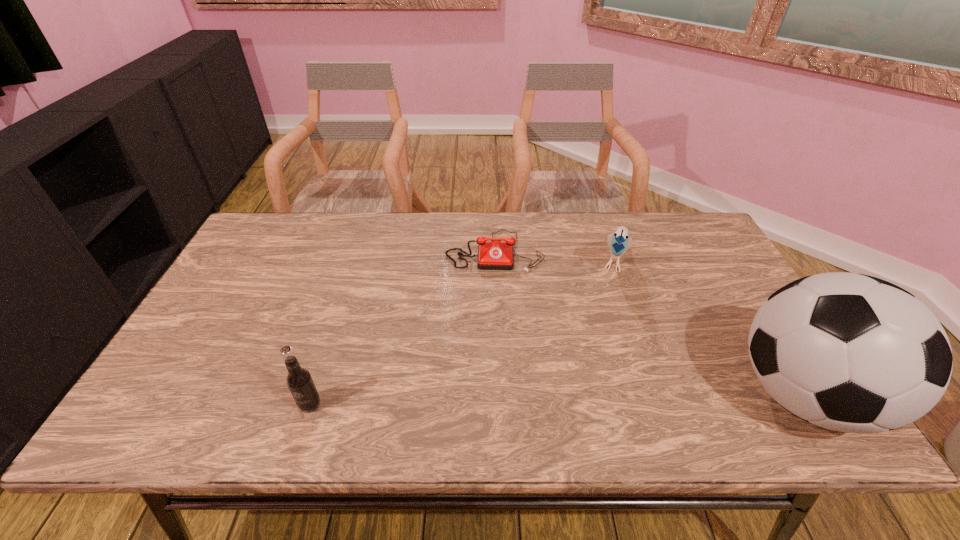
In order to click on vacant space in between the bird and the tallest object in this screenshot , I will do `click(708, 328)`.

What are the coordinates of `free spot between the soccer ball and the second object from right to left` in the screenshot? It's located at click(x=708, y=328).

You are a GUI agent. You are given a task and a screenshot of the screen. Output one action in this format:
    pyautogui.click(x=<x>, y=<y>)
    Task: Click on the free spot between the telephone and the root beer
    This screenshot has width=960, height=540.
    Given the screenshot: What is the action you would take?
    pyautogui.click(x=402, y=328)

Locate an element on the screen. The height and width of the screenshot is (540, 960). object that is the third nearest to the second object from left to right is located at coordinates (300, 383).

Select which object is the closest to the tallest object. Please provide its 2D coordinates. Your answer should be formatted as a tuple, i.e. [(x, y)], where the tuple contains the x and y coordinates of a point satisfying the conditions above.

[(619, 242)]

Image resolution: width=960 pixels, height=540 pixels. Find the location of `free space that satisfies the following two spatial constraints: 1. on the front side of the tallest object; 2. on the left side of the third object from left to right`. free space that satisfies the following two spatial constraints: 1. on the front side of the tallest object; 2. on the left side of the third object from left to right is located at coordinates (662, 395).